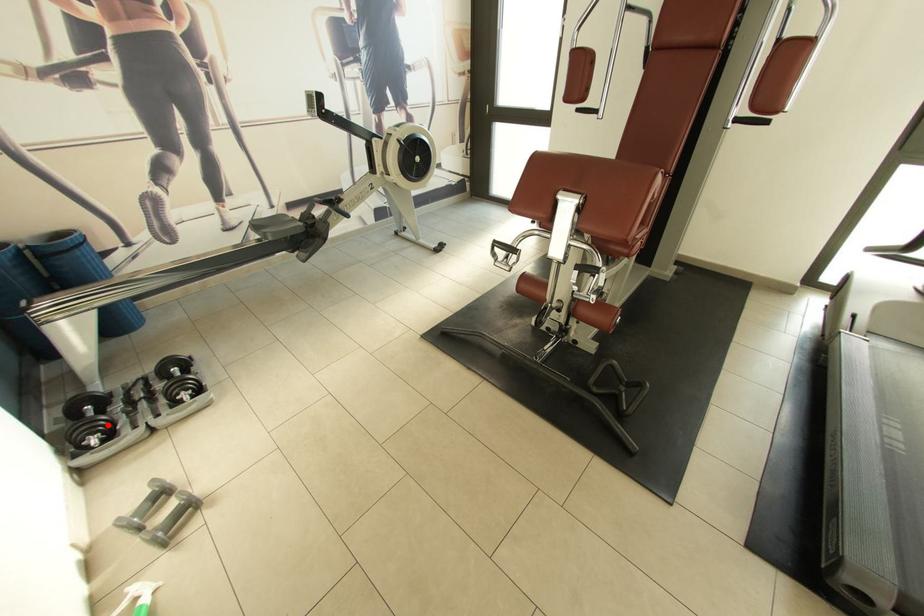
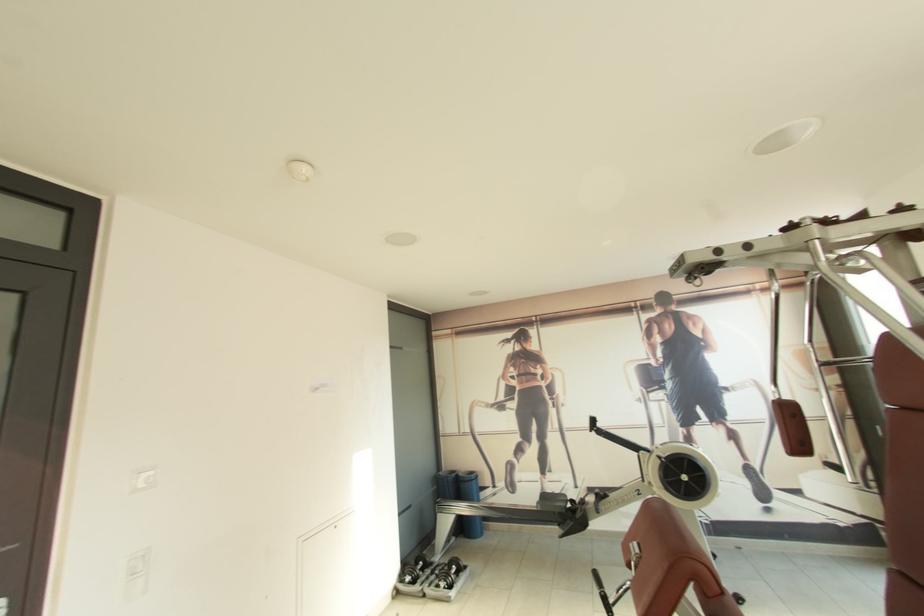
Question: I am providing you with two images of the same scene from different viewpoints. A red point is marked on the first image. Can you still see the location of the red point in image 2?

Choices:
 (A) Yes
 (B) No

Answer: (A)